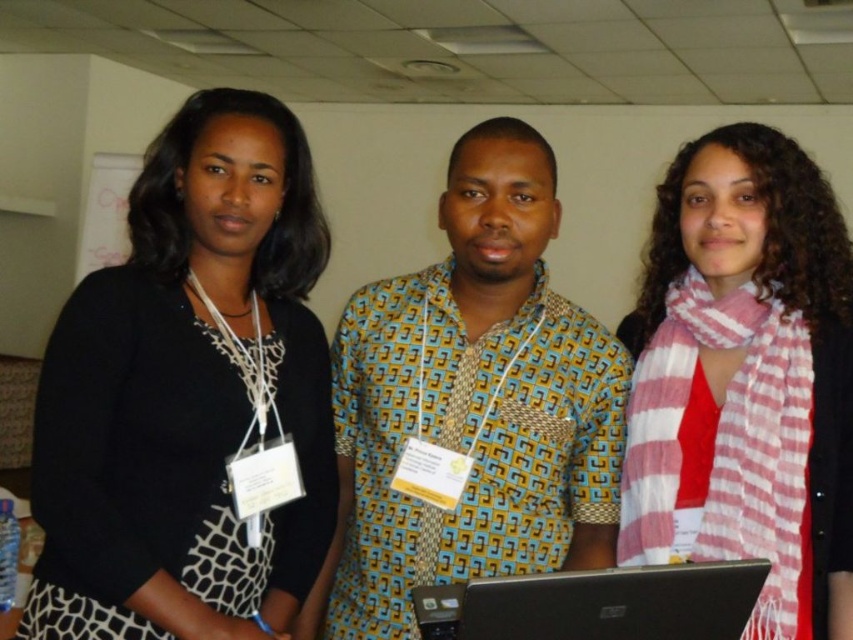
Is yellow printed shirt at center taller than black plastic laptop at center?

Yes, yellow printed shirt at center is taller than black plastic laptop at center.

Which is below, yellow printed shirt at center or black plastic laptop at center?

Positioned lower is black plastic laptop at center.

The width and height of the screenshot is (853, 640). What do you see at coordinates (471, 403) in the screenshot?
I see `yellow printed shirt at center` at bounding box center [471, 403].

Where is `yellow printed shirt at center`? This screenshot has width=853, height=640. yellow printed shirt at center is located at coordinates (471, 403).

Which is below, black matte sweater at left or pink striped scarf at center?

pink striped scarf at center is lower down.

Does black matte sweater at left come behind pink striped scarf at center?

Yes, black matte sweater at left is behind pink striped scarf at center.

The height and width of the screenshot is (640, 853). In order to click on black matte sweater at left in this screenshot , I will do `click(190, 397)`.

This screenshot has width=853, height=640. I want to click on black matte sweater at left, so click(x=190, y=397).

How distant is pink striped scarf at center from black plastic laptop at center?

The distance of pink striped scarf at center from black plastic laptop at center is 16.13 inches.

Is pink striped scarf at center behind black plastic laptop at center?

That is True.

The image size is (853, 640). What do you see at coordinates (746, 380) in the screenshot?
I see `pink striped scarf at center` at bounding box center [746, 380].

Identify the location of pink striped scarf at center. Image resolution: width=853 pixels, height=640 pixels. (746, 380).